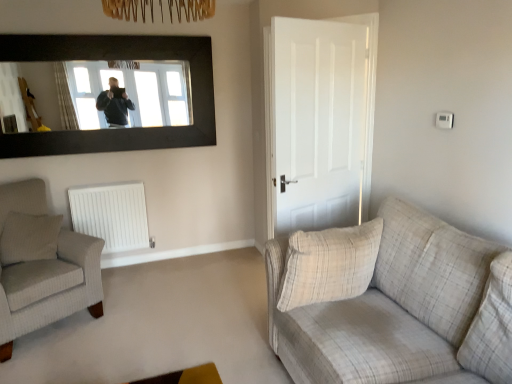
Question: Can you confirm if white matte door at center is shorter than beige textured pillow at left, which is the first pillow from back to front?

Choices:
 (A) yes
 (B) no

Answer: (B)

Question: From a real-world perspective, is white matte door at center on beige textured pillow at left, which is the 2th pillow in front-to-back order?

Choices:
 (A) no
 (B) yes

Answer: (B)

Question: Is white matte door at center wider than beige textured pillow at left, which is the first pillow from back to front?

Choices:
 (A) no
 (B) yes

Answer: (A)

Question: Is the surface of white matte door at center in direct contact with beige textured pillow at left, acting as the 2th pillow starting from the right?

Choices:
 (A) yes
 (B) no

Answer: (B)

Question: Is beige textured pillow at left, acting as the 2th pillow starting from the right, a part of white matte door at center?

Choices:
 (A) yes
 (B) no

Answer: (B)

Question: Is point pyautogui.click(x=105, y=233) positioned closer to the camera than point pyautogui.click(x=473, y=362)?

Choices:
 (A) closer
 (B) farther

Answer: (B)

Question: Considering the positions of white matte radiator at lower left and plaid fabric couch at right in the image, is white matte radiator at lower left taller or shorter than plaid fabric couch at right?

Choices:
 (A) short
 (B) tall

Answer: (A)

Question: Would you say white matte radiator at lower left is inside or outside plaid fabric couch at right?

Choices:
 (A) inside
 (B) outside

Answer: (B)

Question: In terms of size, does white matte radiator at lower left appear bigger or smaller than plaid fabric couch at right?

Choices:
 (A) small
 (B) big

Answer: (A)

Question: In the image, is plaid fabric couch at right positioned in front of or behind white matte radiator at lower left?

Choices:
 (A) behind
 (B) front

Answer: (B)

Question: Would you say plaid fabric couch at right is to the left or to the right of white matte radiator at lower left in the picture?

Choices:
 (A) left
 (B) right

Answer: (B)

Question: Is plaid fabric couch at right taller or shorter than white matte radiator at lower left?

Choices:
 (A) short
 (B) tall

Answer: (B)

Question: Looking at their shapes, would you say plaid fabric couch at right is wider or thinner than white matte radiator at lower left?

Choices:
 (A) thin
 (B) wide

Answer: (B)

Question: Is plaid fabric couch at right inside or outside of light gray fabric armchair at left?

Choices:
 (A) outside
 (B) inside

Answer: (A)

Question: Considering the positions of plaid fabric couch at right and light gray fabric armchair at left in the image, is plaid fabric couch at right bigger or smaller than light gray fabric armchair at left?

Choices:
 (A) big
 (B) small

Answer: (A)